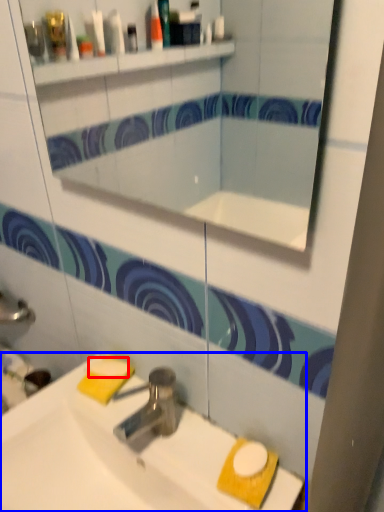
Question: Among these objects, which one is farthest to the camera, soap (highlighted by a red box) or sink (highlighted by a blue box)?

Choices:
 (A) soap
 (B) sink

Answer: (A)